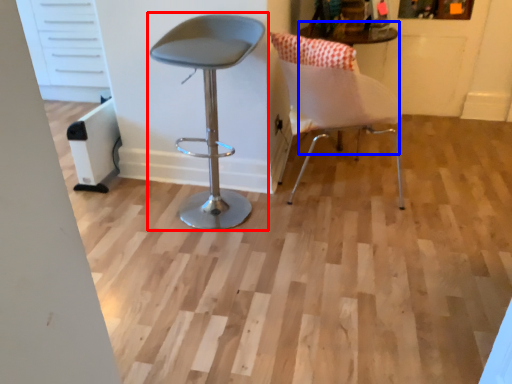
Question: Which object appears farthest to the camera in this image, chair (highlighted by a red box) or round table (highlighted by a blue box)?

Choices:
 (A) chair
 (B) round table

Answer: (B)